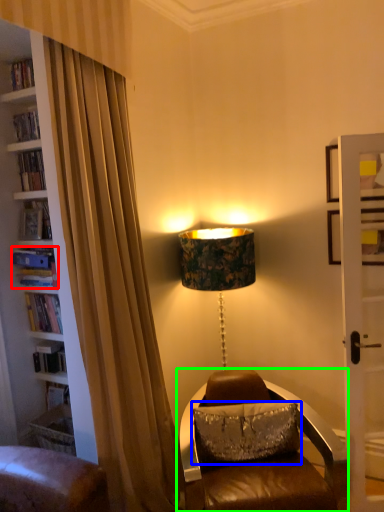
Question: Based on their relative distances, which object is farther from book (highlighted by a red box)? Choose from pillow (highlighted by a blue box) and chair (highlighted by a green box).

Choices:
 (A) pillow
 (B) chair

Answer: (B)